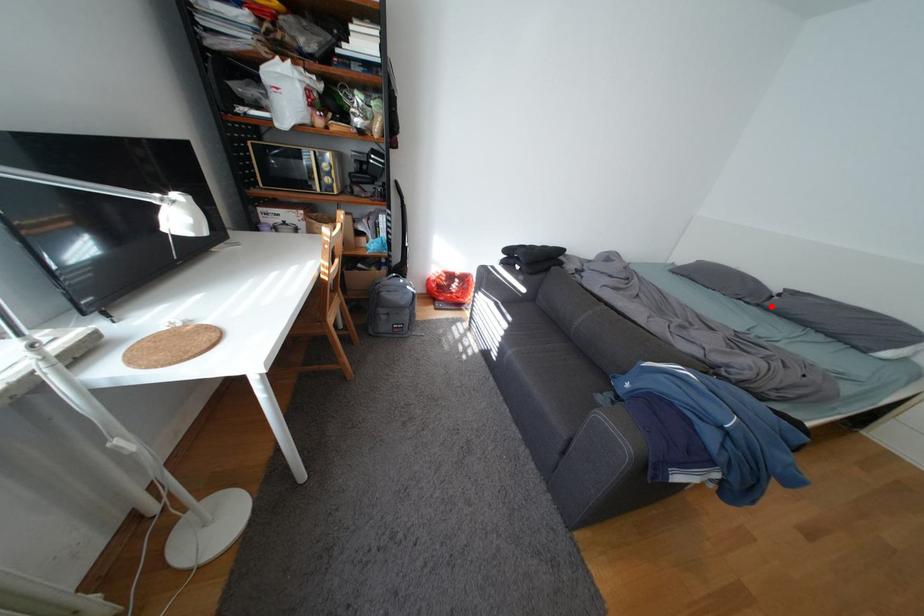
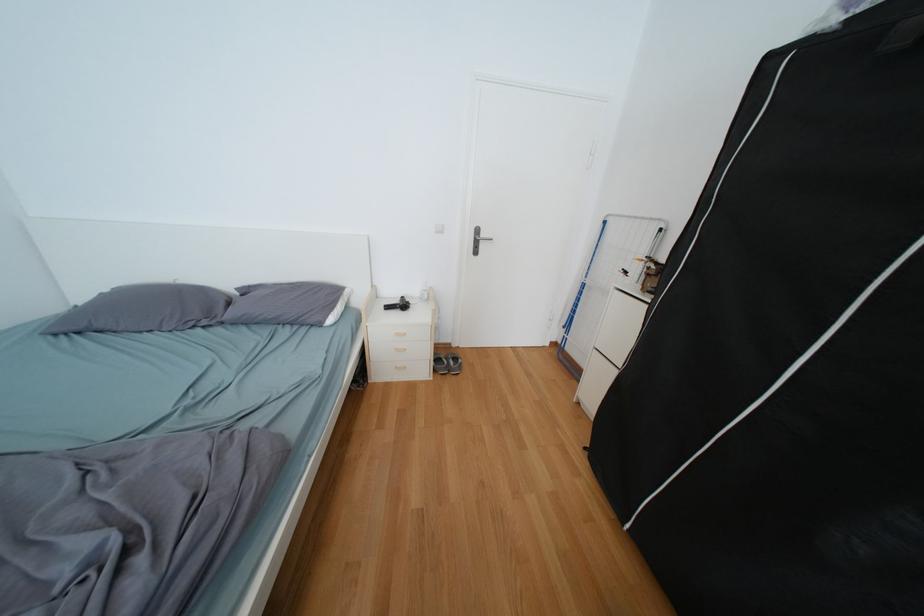
Where in the second image is the point corresponding to the highlighted location from the first image?

(235, 323)